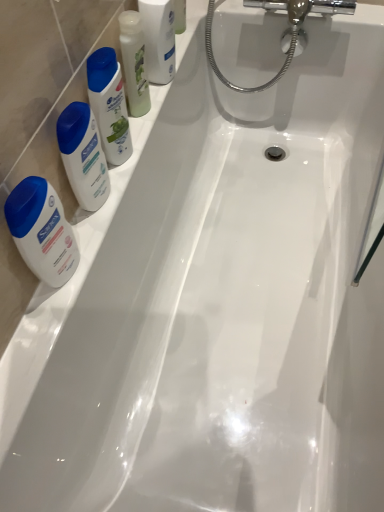
The image size is (384, 512). What are the coordinates of `free spot in front of matte white lotion at left` in the screenshot? It's located at (38, 337).